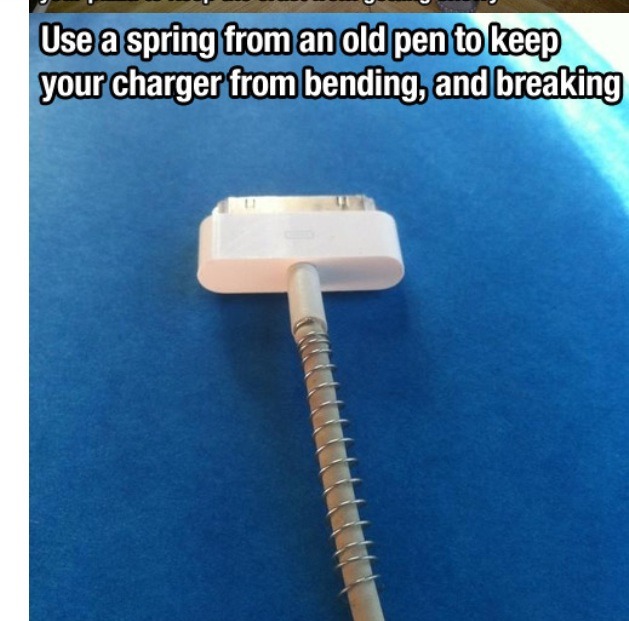
The height and width of the screenshot is (621, 629). I want to click on wire cord protector, so click(355, 558).